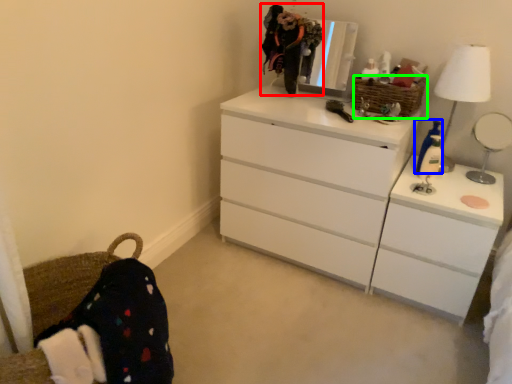
Question: Considering the real-world distances, which object is farthest from selfie (highlighted by a red box)? toy (highlighted by a blue box) or basket (highlighted by a green box)?

Choices:
 (A) toy
 (B) basket

Answer: (A)